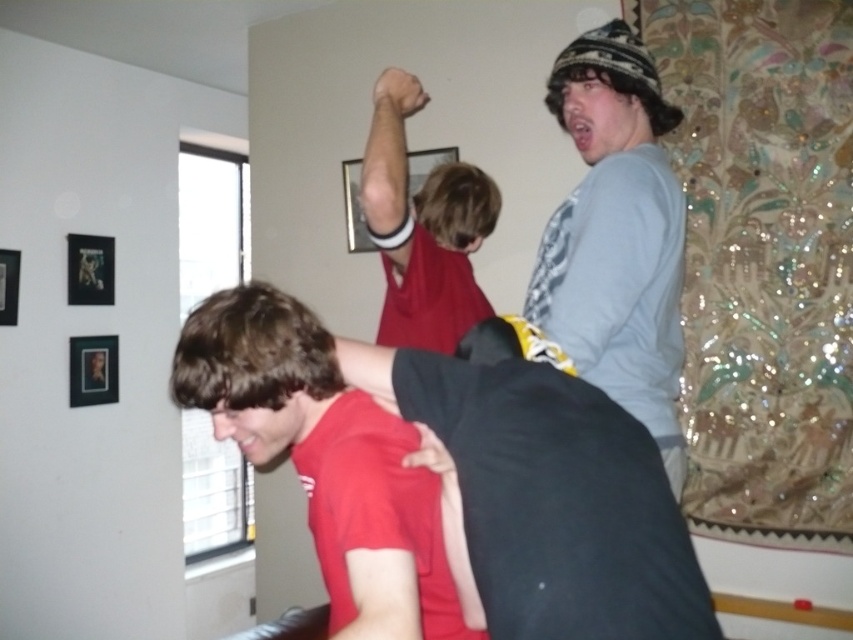
How much distance is there between metallic gold picture frame at upper left and metallic black picture frame at upper left?

They are 12.08 inches apart.

Does point (111, 369) come in front of point (77, 294)?

No, it is not.

This screenshot has width=853, height=640. Describe the element at coordinates (93, 369) in the screenshot. I see `metallic gold picture frame at upper left` at that location.

You are a GUI agent. You are given a task and a screenshot of the screen. Output one action in this format:
    pyautogui.click(x=<x>, y=<y>)
    Task: Click on the metallic gold picture frame at upper left
    
    Given the screenshot: What is the action you would take?
    pyautogui.click(x=93, y=369)

Is metallic black picture frame at upper left closer to camera compared to brushed metal picture frame at upper left?

No, metallic black picture frame at upper left is behind brushed metal picture frame at upper left.

Does point (84, 296) lie behind point (0, 276)?

That is True.

Where is `metallic black picture frame at upper left`? metallic black picture frame at upper left is located at coordinates (90, 269).

Based on the photo, can you confirm if metallic gold picture frame at upper left is wider than matte plastic picture frame at upper center?

No, metallic gold picture frame at upper left is not wider than matte plastic picture frame at upper center.

Who is more forward, (73, 406) or (360, 209)?

Point (360, 209) is in front.

Identify the location of metallic gold picture frame at upper left. (93, 369).